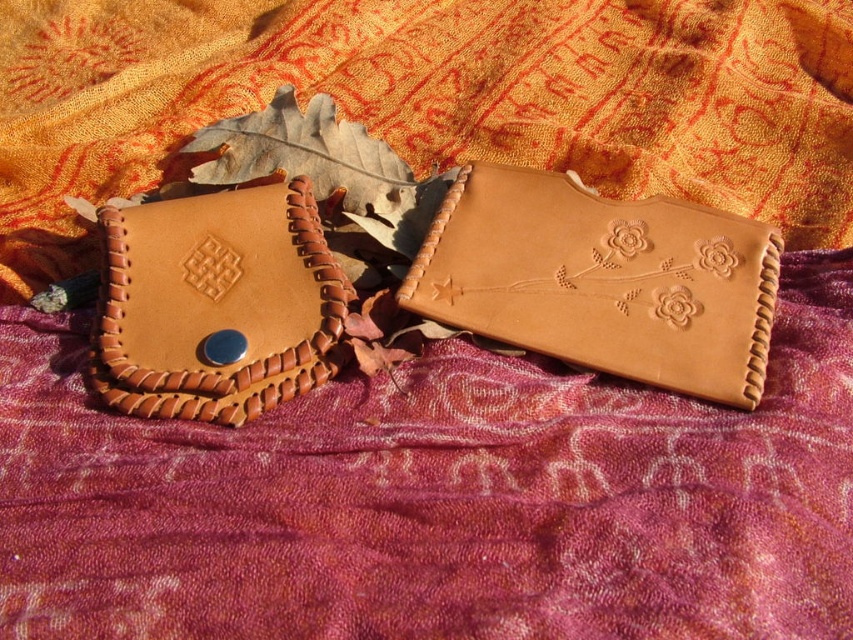
You are organizing a display of wallets and need to place them in order from left to right. Given that you have the tan leather wallet at center and the matte brown leather wallet at left, which one should be placed first on the left side?

The matte brown leather wallet at left should be placed first on the left side since the tan leather wallet at center is positioned to its right in the image.

You are standing in front of the two leather pouches. There are two points marked on the image. The first point is at coordinates point (561, 342) and the second point is at point (177, 273). Which point is closer to you?

Point (561, 342) is in front of point (177, 273), so the first point is closer to you.

You are organizing items on a table and need to place the tan leather wallet at center. Where exactly should you position it relative to the other objects in the scene?

The tan leather wallet at center should be positioned at coordinates point (x=602, y=280) as specified in the description.